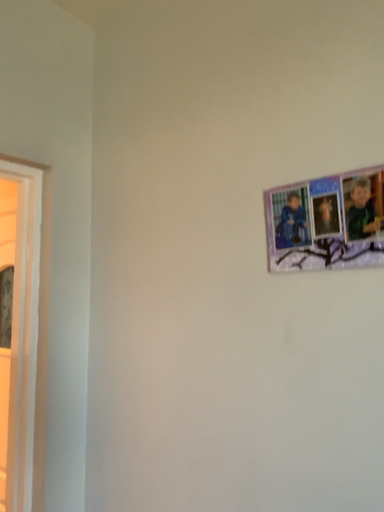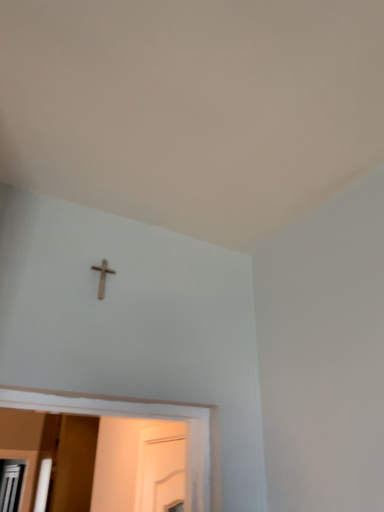
Question: Which way did the camera rotate in the video?

Choices:
 (A) rotated left
 (B) rotated right

Answer: (A)